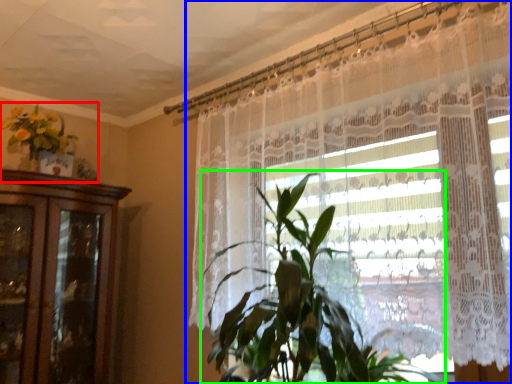
Question: Considering the real-world distances, which object is farthest from floral arrangement (highlighted by a red box)? curtain (highlighted by a blue box) or houseplant (highlighted by a green box)?

Choices:
 (A) curtain
 (B) houseplant

Answer: (B)